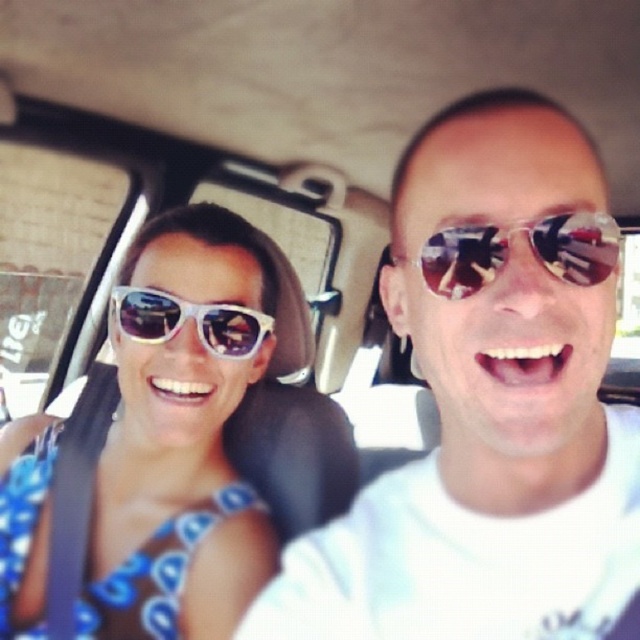
Is shiny reflective sunglasses at center shorter than white plastic sunglasses at left?

Yes, shiny reflective sunglasses at center is shorter than white plastic sunglasses at left.

Between shiny reflective sunglasses at center and white plastic sunglasses at left, which one has more height?

With more height is white plastic sunglasses at left.

Where is `shiny reflective sunglasses at center`? This screenshot has height=640, width=640. shiny reflective sunglasses at center is located at coordinates (531, 248).

Where is `shiny reflective sunglasses at center`? shiny reflective sunglasses at center is located at coordinates (531, 248).

Does white glossy sunglasses at upper left appear on the right side of white plastic sunglasses at left?

Incorrect, white glossy sunglasses at upper left is not on the right side of white plastic sunglasses at left.

Who is more distant from viewer, (205, 218) or (145, 321)?

The point (205, 218) is more distant.

Locate an element on the screen. The image size is (640, 640). white glossy sunglasses at upper left is located at coordinates (182, 432).

Which is more to the left, shiny silver sunglasses at center or white plastic sunglasses at left?

white plastic sunglasses at left is more to the left.

Measure the distance from shiny silver sunglasses at center to white plastic sunglasses at left.

The distance of shiny silver sunglasses at center from white plastic sunglasses at left is 37.13 centimeters.

The image size is (640, 640). Identify the location of shiny silver sunglasses at center. (490, 403).